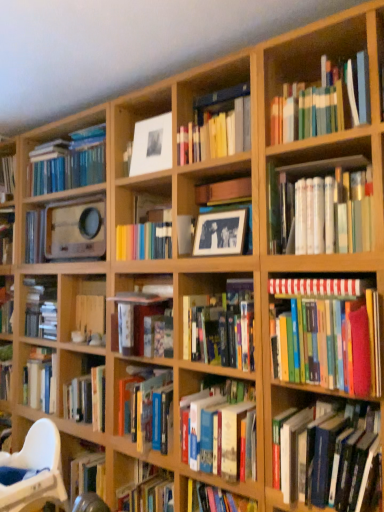
Question: Is hardcover books at center, the 4th book when ordered from bottom to top, positioned behind hardcover book at center, which is counted as the third book, starting from the bottom?

Choices:
 (A) no
 (B) yes

Answer: (A)

Question: Is hardcover books at center, the 4th book when ordered from bottom to top, taller than hardcover book at center, the 6th book positioned from the top?

Choices:
 (A) no
 (B) yes

Answer: (B)

Question: From a real-world perspective, is hardcover books at center, which is the 5th book in top-to-bottom order, positioned over hardcover book at center, the 6th book positioned from the top, based on gravity?

Choices:
 (A) no
 (B) yes

Answer: (B)

Question: Does hardcover books at center, the 4th book when ordered from bottom to top, have a greater width compared to hardcover book at center, the 6th book positioned from the top?

Choices:
 (A) no
 (B) yes

Answer: (A)

Question: Is hardcover books at center, which is the 5th book in top-to-bottom order, to the left of hardcover book at center, which is counted as the third book, starting from the bottom, from the viewer's perspective?

Choices:
 (A) yes
 (B) no

Answer: (B)

Question: From a real-world perspective, is hardcover books at center, which is the 5th book in top-to-bottom order, physically below hardcover book at center, which is counted as the third book, starting from the bottom?

Choices:
 (A) yes
 (B) no

Answer: (B)

Question: Is hardcover books at center, acting as the 1th book starting from the bottom, beside hardcover books at right, positioned as the 5th book in bottom-to-top order?

Choices:
 (A) yes
 (B) no

Answer: (B)

Question: Considering the relative sizes of hardcover books at center, acting as the 8th book starting from the top, and hardcover books at right, positioned as the 5th book in bottom-to-top order, in the image provided, is hardcover books at center, acting as the 8th book starting from the top, shorter than hardcover books at right, positioned as the 5th book in bottom-to-top order,?

Choices:
 (A) no
 (B) yes

Answer: (B)

Question: From a real-world perspective, is hardcover books at center, acting as the 1th book starting from the bottom, located higher than hardcover books at right, arranged as the fourth book when viewed from the top?

Choices:
 (A) yes
 (B) no

Answer: (B)

Question: Does hardcover books at center, acting as the 8th book starting from the top, have a larger size compared to hardcover books at right, arranged as the fourth book when viewed from the top?

Choices:
 (A) yes
 (B) no

Answer: (B)

Question: Considering the relative positions of hardcover books at center, acting as the 8th book starting from the top, and hardcover books at right, arranged as the fourth book when viewed from the top, in the image provided, is hardcover books at center, acting as the 8th book starting from the top, to the left of hardcover books at right, arranged as the fourth book when viewed from the top, from the viewer's perspective?

Choices:
 (A) yes
 (B) no

Answer: (A)

Question: Can you confirm if hardcover books at center, acting as the 8th book starting from the top, is wider than hardcover books at right, arranged as the fourth book when viewed from the top?

Choices:
 (A) no
 (B) yes

Answer: (A)

Question: Is white matte picture frame at upper center taller than white glossy book at upper right, the seventh book ordered from the bottom?

Choices:
 (A) no
 (B) yes

Answer: (B)